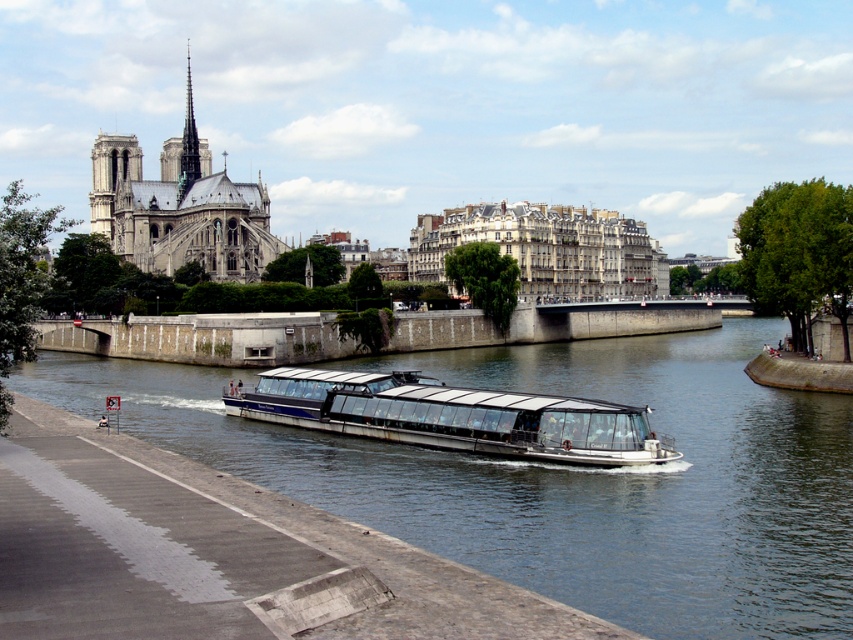
You are a tourist standing on the walkway near the river. You want to take a photo of the stone gothic cathedral at upper left without the white matte glass boat at center blocking the view. Is it possible?

The white matte glass boat at center is shorter than the stone gothic cathedral at upper left, so it is possible to take a photo of the stone gothic cathedral at upper left without the boat blocking the view because the cathedral is taller and likely visible above the boat.

You are a photographer planning to capture the white matte glass boat at center and the stone gothic cathedral at upper left in the same frame. Given their sizes, which object should you place closer to the edge of the frame to ensure both fit without cropping?

The white matte glass boat at center is thinner than the stone gothic cathedral at upper left, so you should place the stone gothic cathedral at upper left closer to the edge of the frame to ensure both fit without cropping.